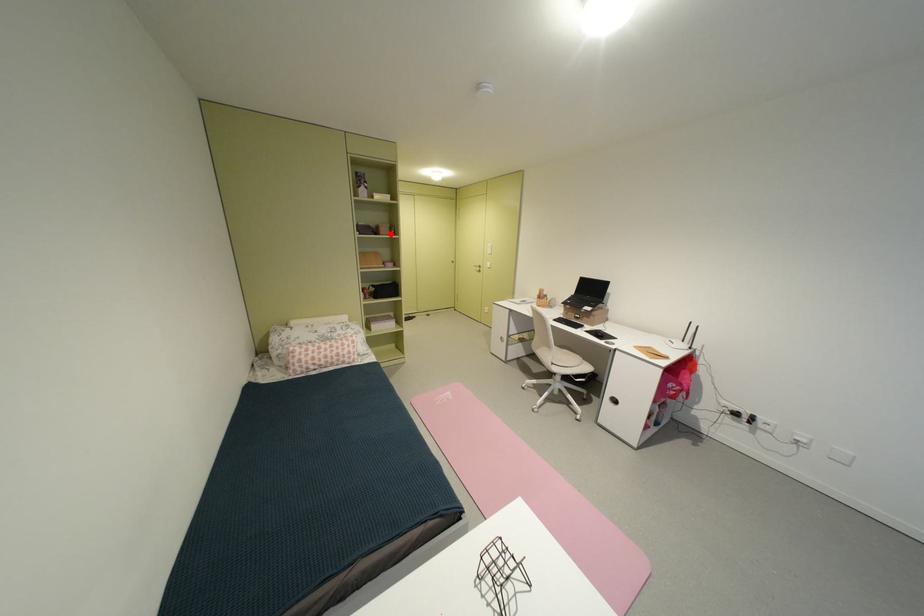
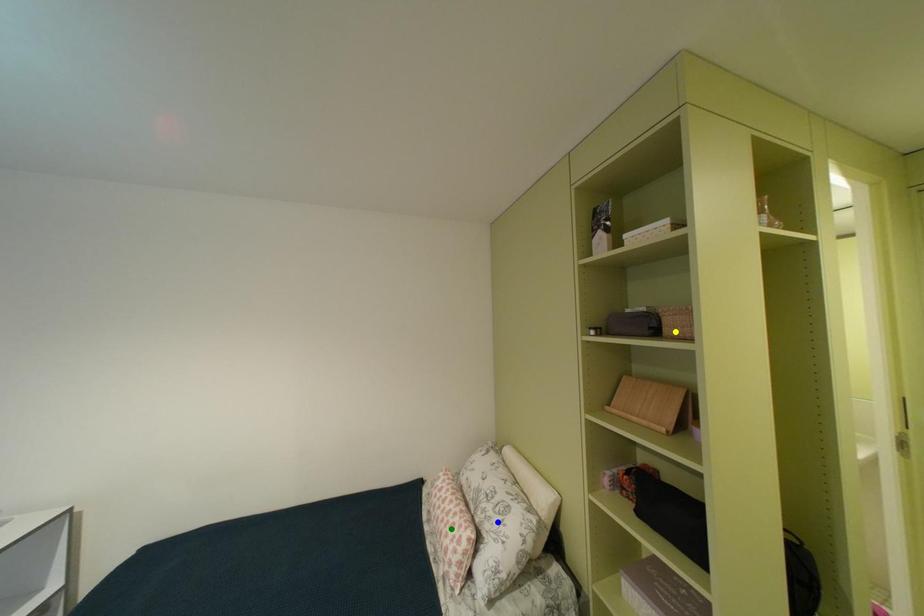
Question: I am providing you with two images of the same scene from different viewpoints. A red point is marked on the first image. You are given multiple points on the second image. Which point in image 2 is actually the same real-world point as the red point in image 1?

Choices:
 (A) green point
 (B) blue point
 (C) yellow point

Answer: (C)